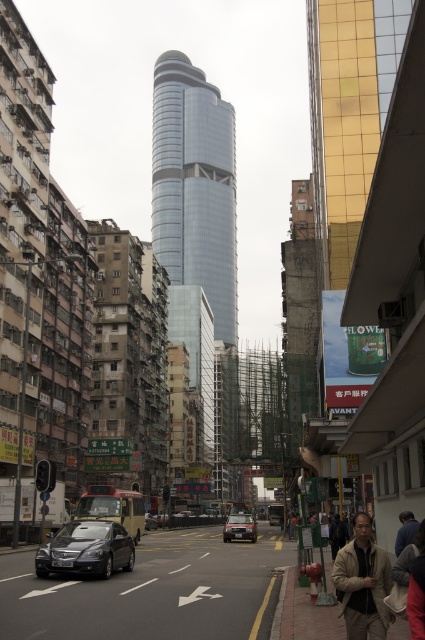
Question: Which is nearer to the matte black car at center?

Choices:
 (A) beige fabric jacket at lower right
 (B) shiny black sedan at lower left
 (C) shiny glass tower at center

Answer: (B)

Question: Is shiny glass tower at center behind beige fabric jacket at lower right?

Choices:
 (A) no
 (B) yes

Answer: (B)

Question: Can you confirm if shiny glass tower at center is smaller than matte black car at center?

Choices:
 (A) yes
 (B) no

Answer: (B)

Question: Which point is closer to the camera?

Choices:
 (A) blue fabric shirt at lower right
 (B) shiny black sedan at lower left
 (C) beige fabric jacket at lower right
 (D) matte black car at center

Answer: (C)

Question: Where is beige fabric jacket at lower right located in relation to black rubber car at center in the image?

Choices:
 (A) below
 (B) above

Answer: (B)

Question: Which object appears closest to the camera in this image?

Choices:
 (A) shiny glass tower at center
 (B) blue fabric shirt at lower right

Answer: (B)